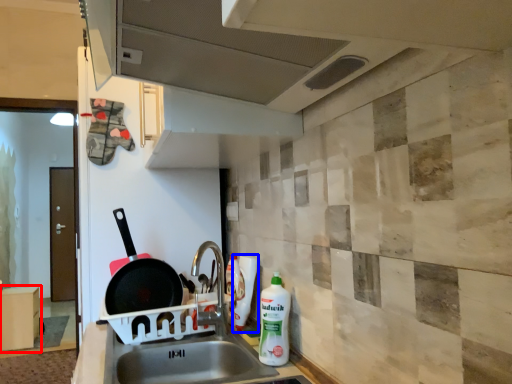
Question: Which of the following is the farthest to the observer, cabinetry (highlighted by a red box) or bottle (highlighted by a blue box)?

Choices:
 (A) cabinetry
 (B) bottle

Answer: (A)